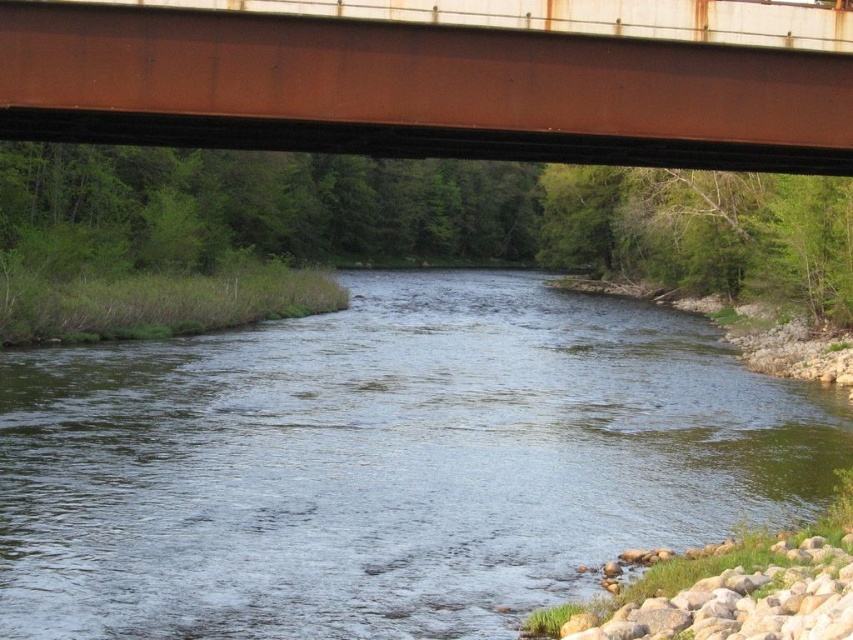
You are a kayaker planning to navigate under the rusty metal bridge at upper center. The clear water at center is where you need to pass through. Based on the scene, can you determine if there is enough vertical clearance for your kayak?

The clear water at center has a greater height compared to the rusty metal bridge at upper center, meaning the water is higher than the bridge. This suggests that there is sufficient vertical clearance for your kayak to pass underneath the bridge safely.

You are a photographer standing at the edge of the river under the bridge. You want to take a photo that includes both the point at coordinates point (166,576) and point (16,17). Which point should you focus on first to ensure both are in focus?

You should focus on point (166,576) first because it is closer to the camera than point (16,17). This ensures that both points will be in focus as the camera adjusts for the closer subject.